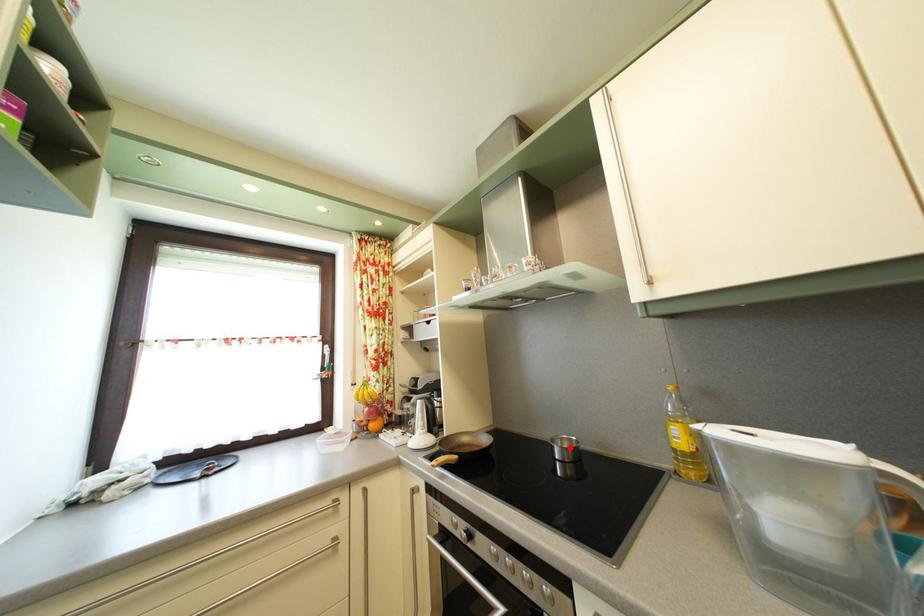
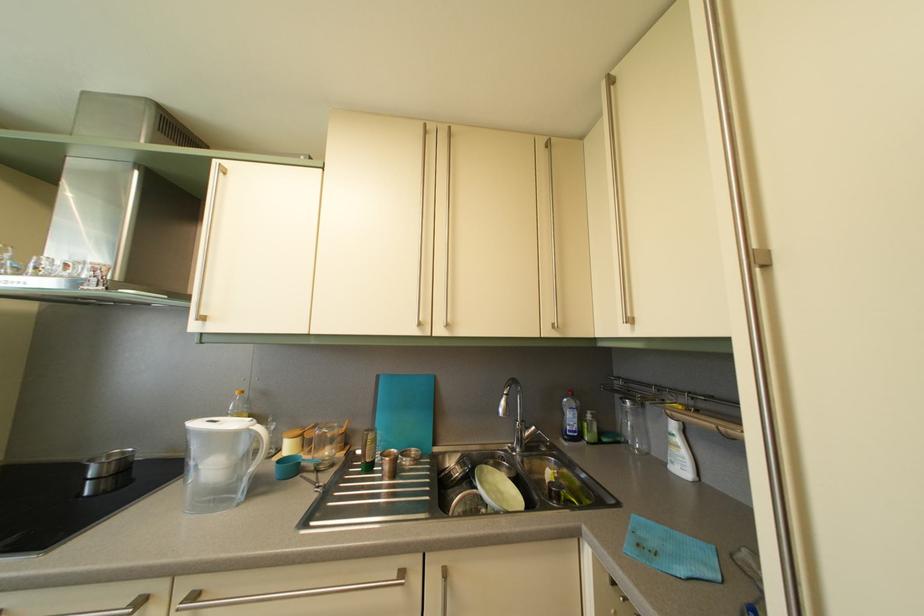
In the second image, find the point that corresponds to the highlighted location in the first image.

(118, 463)